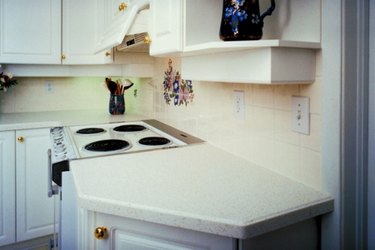
You are a GUI agent. You are given a task and a screenshot of the screen. Output one action in this format:
    pyautogui.click(x=<x>, y=<y>)
    Task: Click on the counter
    Image resolution: width=375 pixels, height=250 pixels.
    Given the screenshot: What is the action you would take?
    pyautogui.click(x=221, y=193)